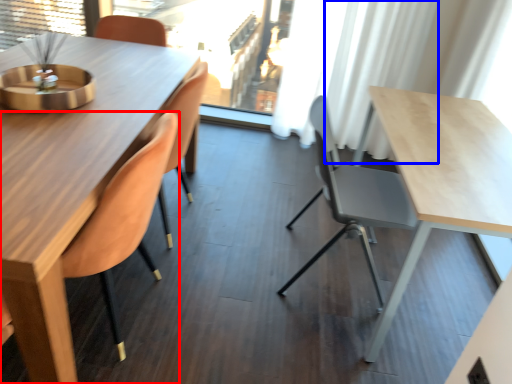
Question: Among these objects, which one is nearest to the camera, chair (highlighted by a red box) or curtain (highlighted by a blue box)?

Choices:
 (A) chair
 (B) curtain

Answer: (A)